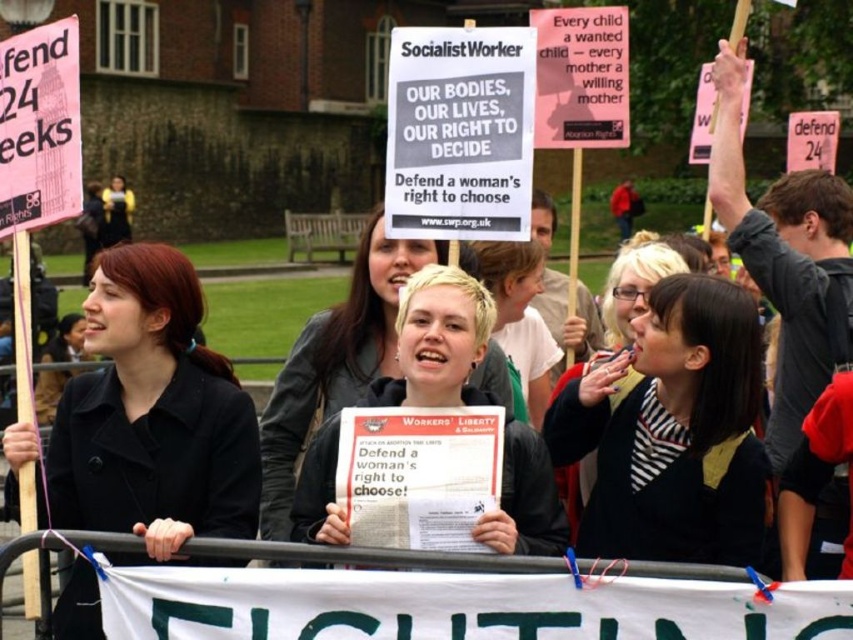
You are a photographer standing at the edge of the protest scene. You want to take a photo of the matte black coat at left and the striped fabric shirt at center. If your camera can focus on objects within 50 feet, will both subjects be in focus?

The matte black coat at left is 44.89 feet away from the striped fabric shirt at center. Since the camera can focus on objects within 50 feet, both subjects will be in focus as their distance falls within the camera range.

You are a photographer trying to capture a clear shot of the protester at the center. The protester is wearing a striped fabric shirt and has blonde hair. Can you see both the striped fabric shirt at center and the blonde hair at center in your photo?

Yes, the striped fabric shirt at center is positioned over blonde hair at center, so both are visible in the photo.